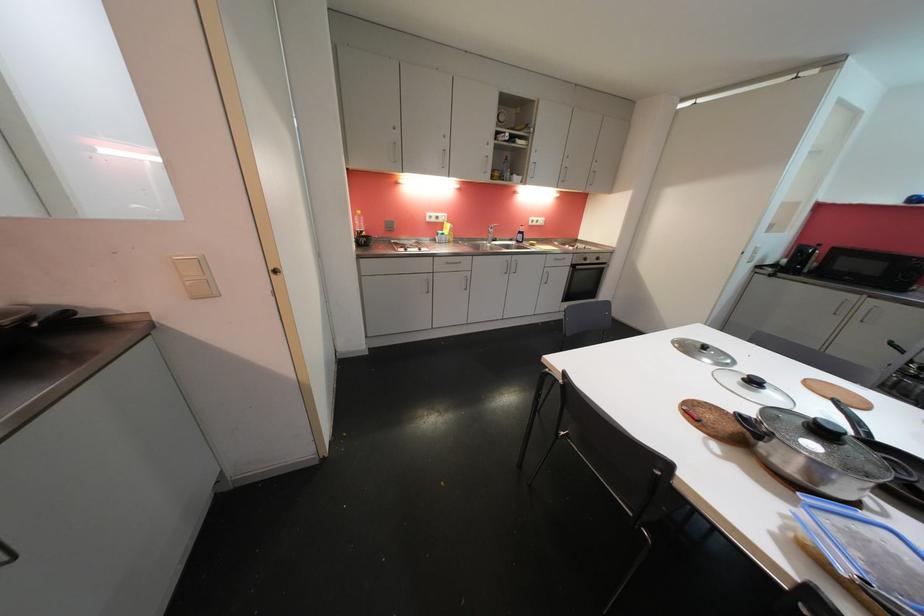
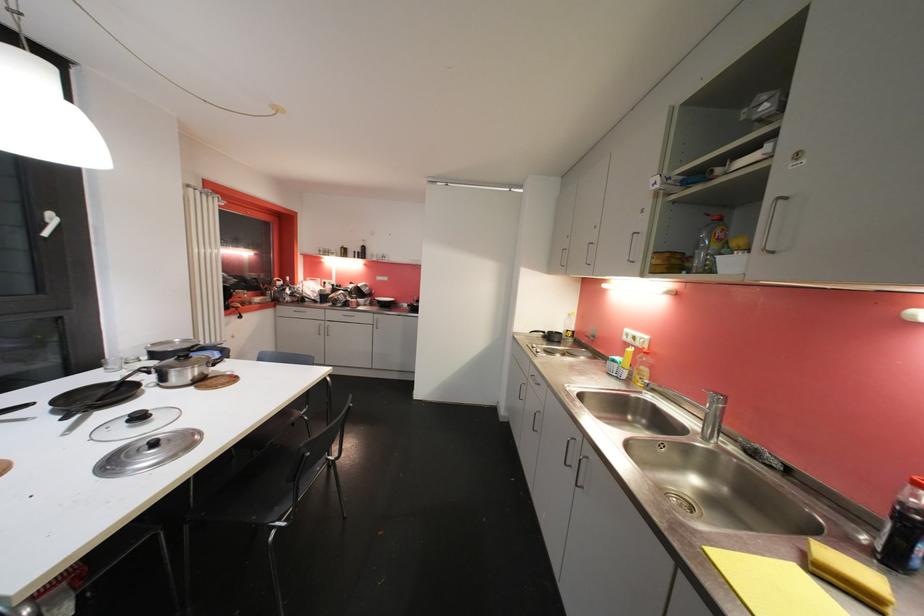
Where in the second image is the point corresponding to pixel 748 419 from the first image?

(221, 367)